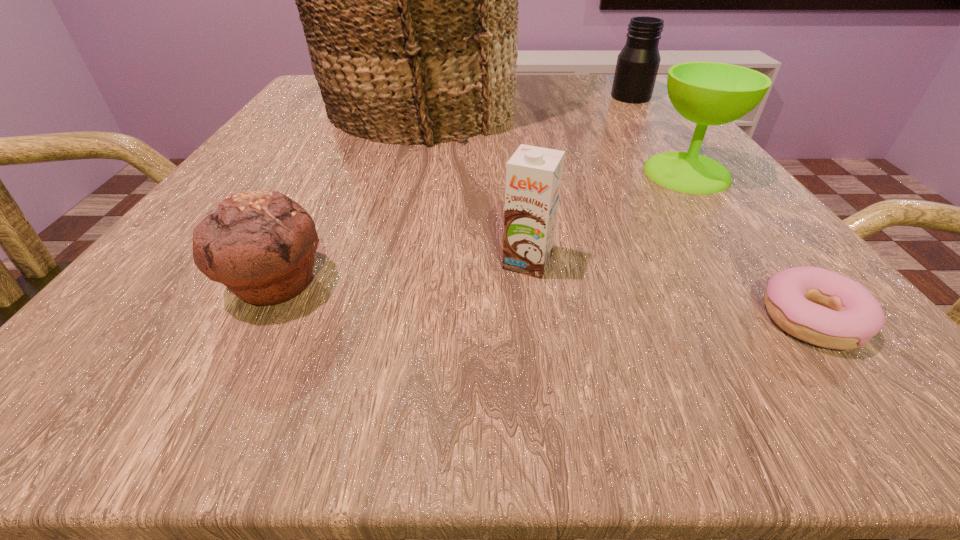
This screenshot has height=540, width=960. I want to click on free region located on the back of the second shortest object, so click(349, 141).

The width and height of the screenshot is (960, 540). I want to click on free space located on the left of the doughnut, so click(x=693, y=320).

Identify the location of basket present at the far edge. The image size is (960, 540). (409, 0).

Identify the location of jar that is at the far edge. (637, 66).

You are a GUI agent. You are given a task and a screenshot of the screen. Output one action in this format:
    pyautogui.click(x=<x>, y=<y>)
    Task: Click on the muffin situated at the near edge
    
    Given the screenshot: What is the action you would take?
    click(x=260, y=244)

This screenshot has height=540, width=960. Identify the location of doughnut that is at the near edge. (824, 308).

The height and width of the screenshot is (540, 960). I want to click on basket that is positioned at the left edge, so click(x=409, y=0).

Find the location of a particular element. The height and width of the screenshot is (540, 960). muffin that is at the left edge is located at coordinates (260, 244).

The width and height of the screenshot is (960, 540). In order to click on jar positioned at the right edge in this screenshot , I will do `click(637, 66)`.

Identify the location of wineglass that is at the right edge. (708, 93).